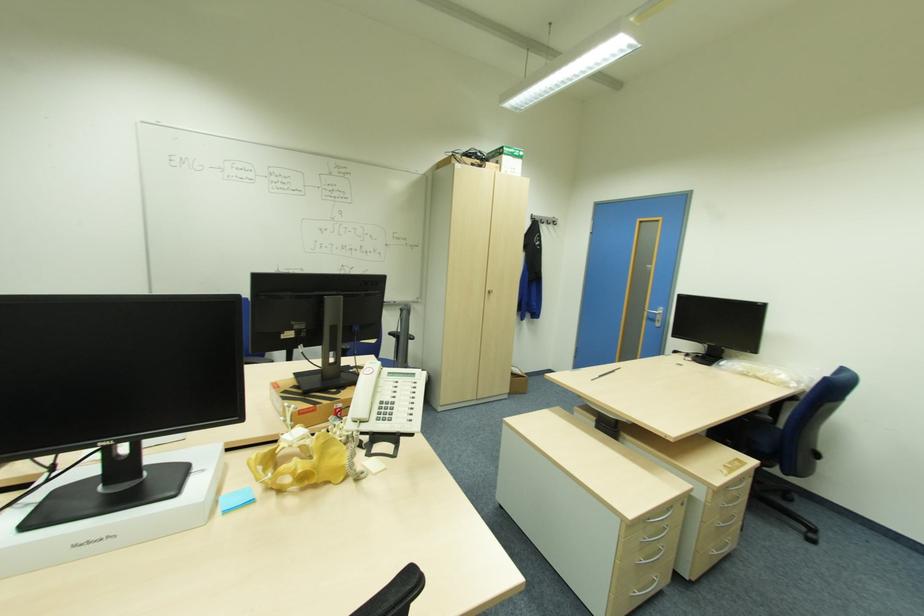
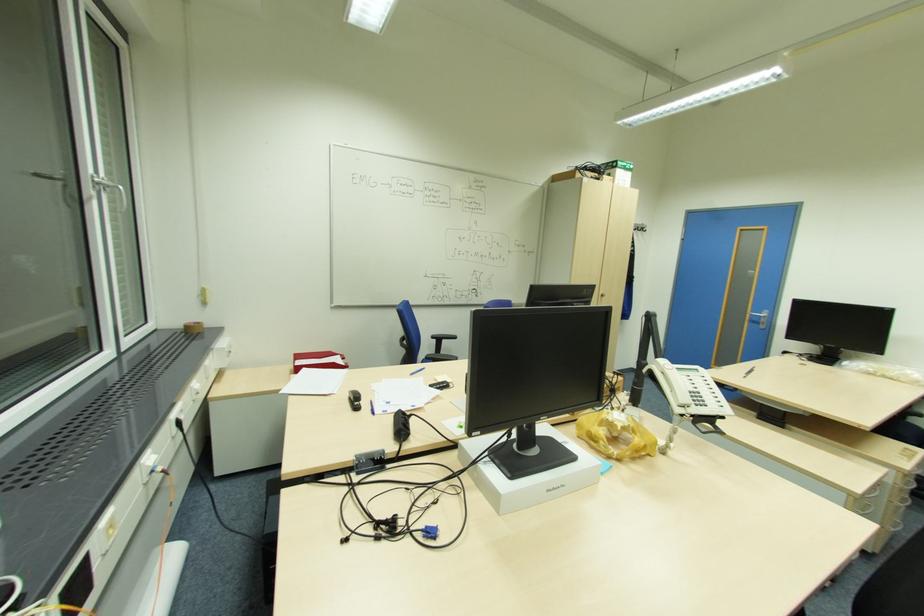
Locate, in the second image, the point that corresponds to pixel 207 469 in the first image.

(568, 442)